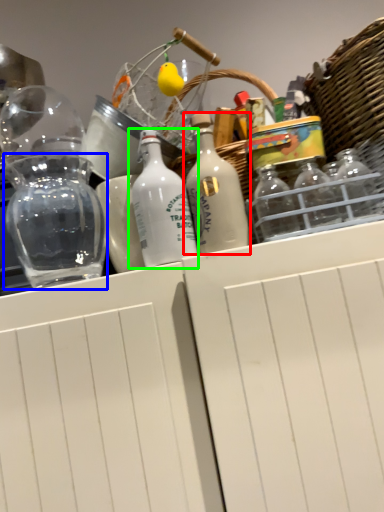
Question: Which object is the farthest from bottle (highlighted by a red box)? Choose among these: glass jar (highlighted by a blue box) or bottle (highlighted by a green box).

Choices:
 (A) glass jar
 (B) bottle

Answer: (A)